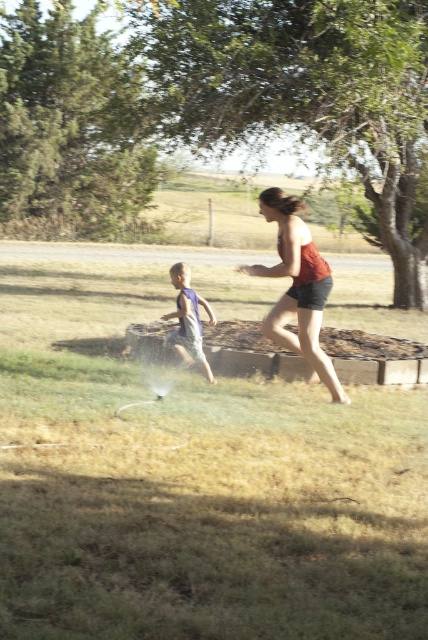
Question: Does green grass at center appear over blue cotton shorts at left?

Choices:
 (A) no
 (B) yes

Answer: (A)

Question: Among these objects, which one is nearest to the camera?

Choices:
 (A) matte red tank top at center
 (B) blue cotton shorts at left

Answer: (A)

Question: Where is green grass at center located in relation to blue cotton shorts at left in the image?

Choices:
 (A) above
 (B) below

Answer: (B)

Question: Which point appears farthest from the camera in this image?

Choices:
 (A) (195, 330)
 (B) (276, 275)

Answer: (A)

Question: In this image, where is matte red tank top at center located relative to blue cotton shorts at left?

Choices:
 (A) left
 (B) right

Answer: (B)

Question: Among these points, which one is nearest to the camera?

Choices:
 (A) (189, 330)
 (B) (193, 566)

Answer: (B)